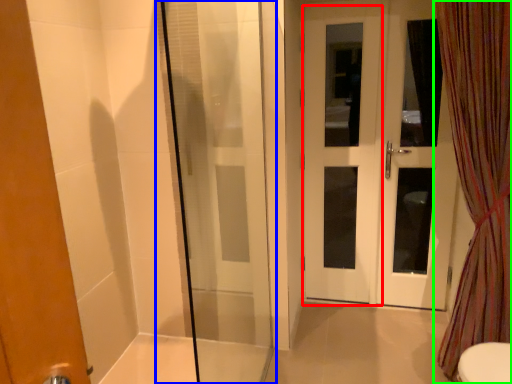
Question: Which object is positioned closest to screen door (highlighted by a red box)? Select from shower door (highlighted by a blue box) and curtain (highlighted by a green box).

Choices:
 (A) shower door
 (B) curtain

Answer: (A)